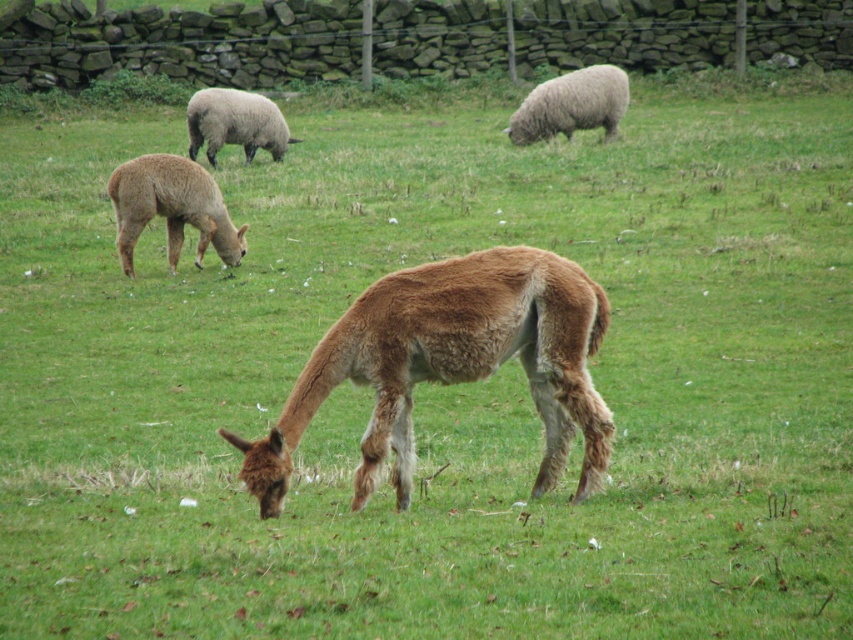
You are standing at the center of the field and want to walk to the stone wall. There is a brown woolen sheep at left. Which direction should you walk to reach the stone wall without going near the sheep?

The brown woolen sheep at left is located at point (171, 209), so you should walk towards the upper part of the field where the stone wall is situated, avoiding the area near the sheep.